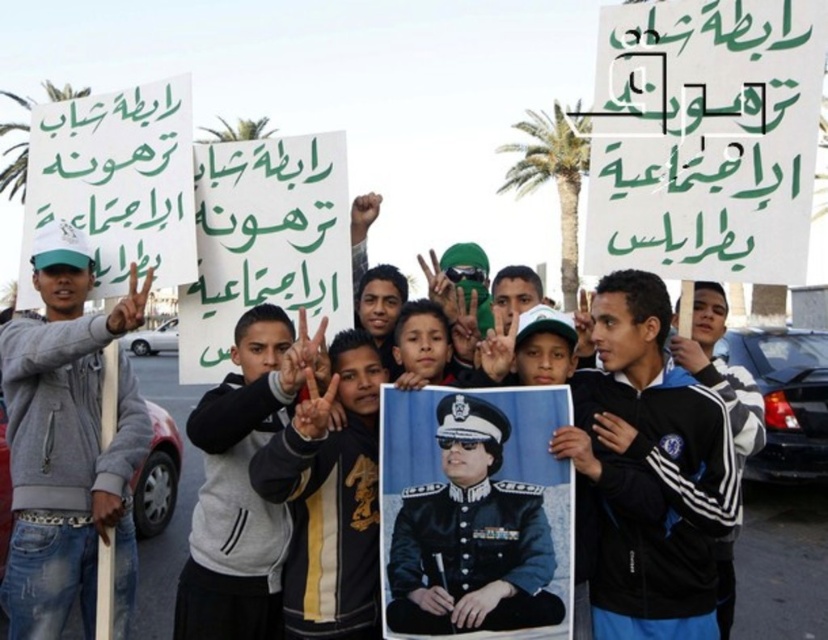
Question: Which of the following is the closest to the observer?

Choices:
 (A) dark blue uniform at center
 (B) gray fleece jacket at center
 (C) green paper sign at upper center

Answer: (A)

Question: Which of the following is the closest to the observer?

Choices:
 (A) (355, 548)
 (B) (670, 506)
 (C) (272, 525)
 (D) (605, 182)

Answer: (B)

Question: Among these points, which one is farthest from the camera?

Choices:
 (A) (292, 513)
 (B) (802, 80)
 (C) (619, 394)
 (D) (415, 625)

Answer: (B)

Question: Is green paper sign at upper center wider than gray fleece jacket at center?

Choices:
 (A) no
 (B) yes

Answer: (B)

Question: Does gray fleece jacket at center have a lesser width compared to dark blue uniform at center?

Choices:
 (A) yes
 (B) no

Answer: (B)

Question: Does uniformed officer portrait at center have a greater width compared to black matte jacket at center?

Choices:
 (A) no
 (B) yes

Answer: (B)